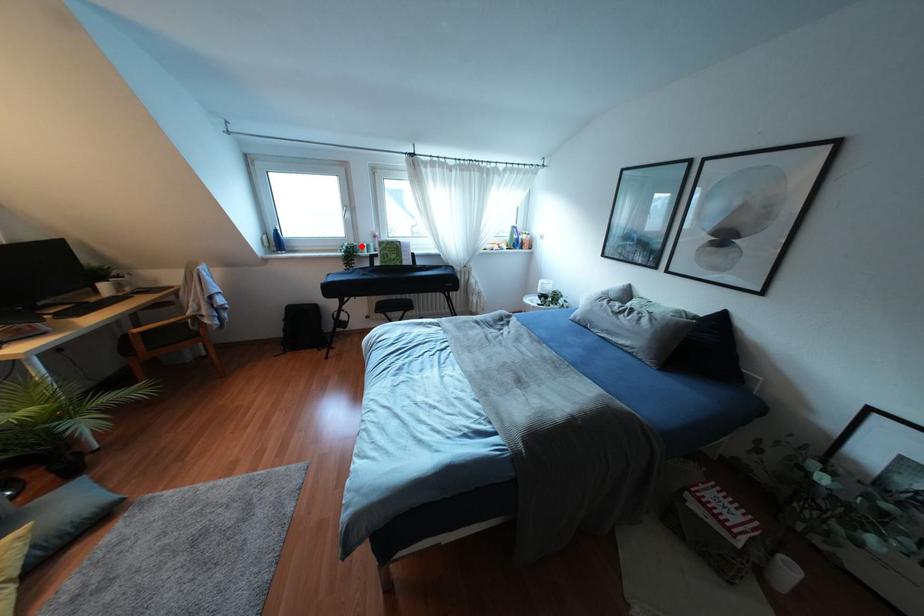
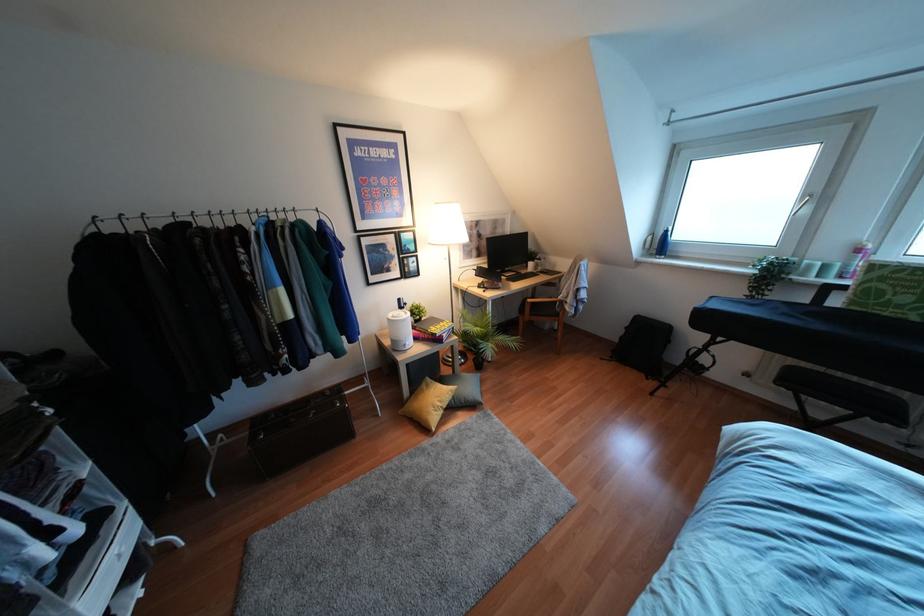
The point at the highlighted location is marked in the first image. Where is the corresponding point in the second image?

(809, 265)